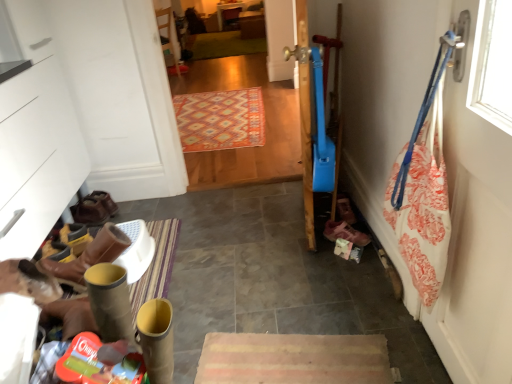
Identify the location of free spot in front of pink fabric shoe at lower right, the third footwear in the left-to-right sequence. This screenshot has height=384, width=512. (343, 269).